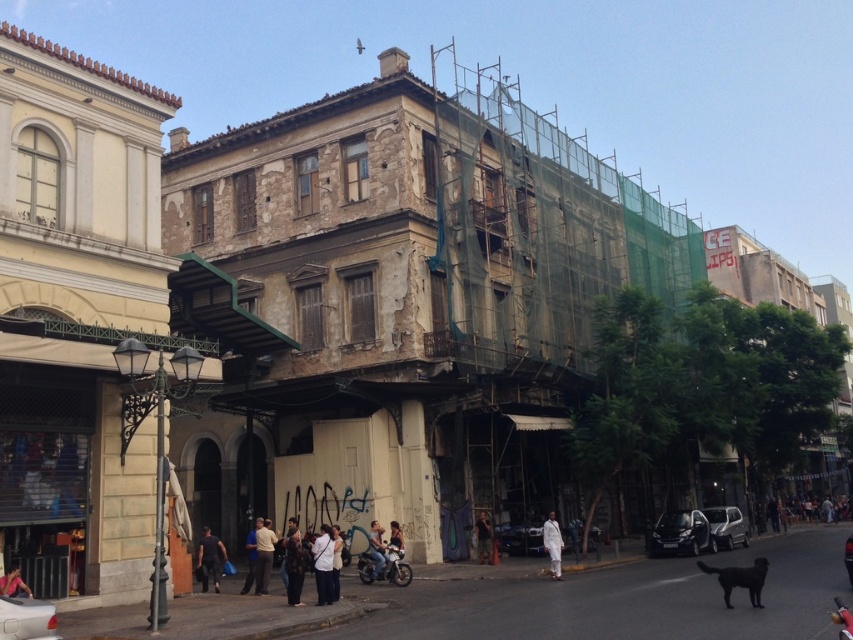
Question: Which object is farther from the camera taking this photo?

Choices:
 (A) dark blue jeans at lower left
 (B) green mesh scaffolding at center
 (C) light brown leather jacket at center

Answer: (B)

Question: Which is nearer to the white matte shirt at center?

Choices:
 (A) dark blue jeans at lower left
 (B) dark brown leather jacket at lower center
 (C) light brown leather jacket at center
 (D) dark blue jeans at center

Answer: (C)

Question: Can you confirm if green mesh scaffolding at center is positioned to the right of dark blue jeans at lower left?

Choices:
 (A) no
 (B) yes

Answer: (B)

Question: Is dark blue jeans at lower left to the right of light brown leather jacket at center from the viewer's perspective?

Choices:
 (A) yes
 (B) no

Answer: (B)

Question: Which of the following is the farthest from the observer?

Choices:
 (A) dark brown leather jacket at lower center
 (B) light blue jeans at center
 (C) green mesh scaffolding at center

Answer: (C)

Question: Does dark blue jeans at lower left appear on the left side of dark blue jeans at center?

Choices:
 (A) yes
 (B) no

Answer: (A)